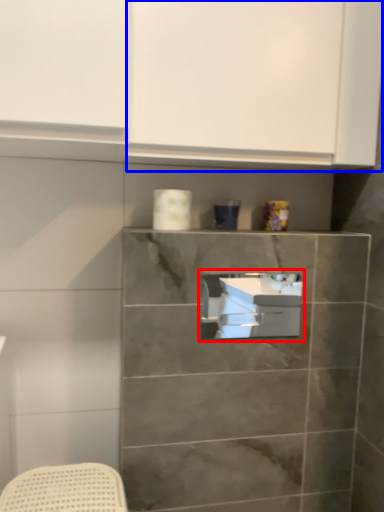
Question: Among these objects, which one is nearest to the camera, sink (highlighted by a red box) or cabinetry (highlighted by a blue box)?

Choices:
 (A) sink
 (B) cabinetry

Answer: (B)